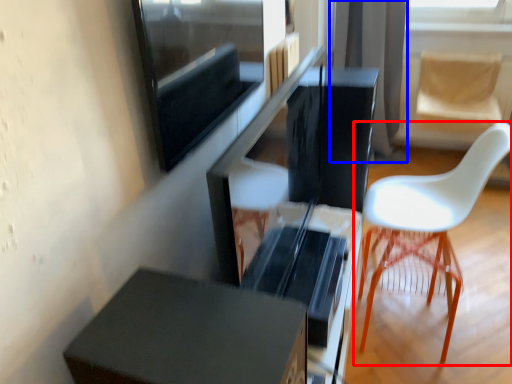
Question: Which of the following is the closest to the observer, chair (highlighted by a red box) or curtain (highlighted by a blue box)?

Choices:
 (A) chair
 (B) curtain

Answer: (A)